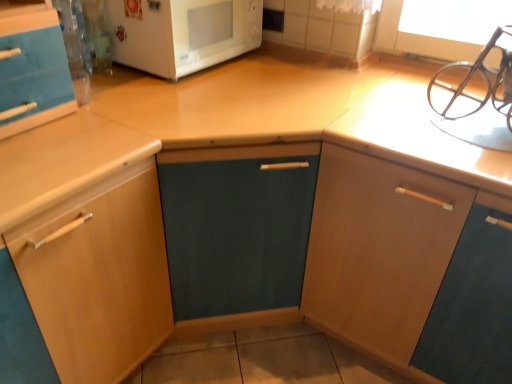
Question: Visually, is wooden cabinet at left, the second cabinetry viewed from the right, positioned to the left or to the right of white glossy microwave at upper center?

Choices:
 (A) left
 (B) right

Answer: (A)

Question: Does point (98, 273) appear closer or farther from the camera than point (159, 72)?

Choices:
 (A) closer
 (B) farther

Answer: (A)

Question: Estimate the real-world distances between objects in this image. Which object is farther from the white glossy microwave at upper center?

Choices:
 (A) metallic silver sink at upper right
 (B) wooden cabinet at upper right, which appears as the 2th cabinetry when viewed from the left
 (C) wooden cabinet at left, the second cabinetry viewed from the right

Answer: (A)

Question: Based on their relative distances, which object is nearer to the wooden cabinet at left, positioned as the 1th cabinetry in left-to-right order?

Choices:
 (A) white glossy microwave at upper center
 (B) metallic silver sink at upper right
 (C) wooden cabinet at upper right, which appears as the 2th cabinetry when viewed from the left

Answer: (A)